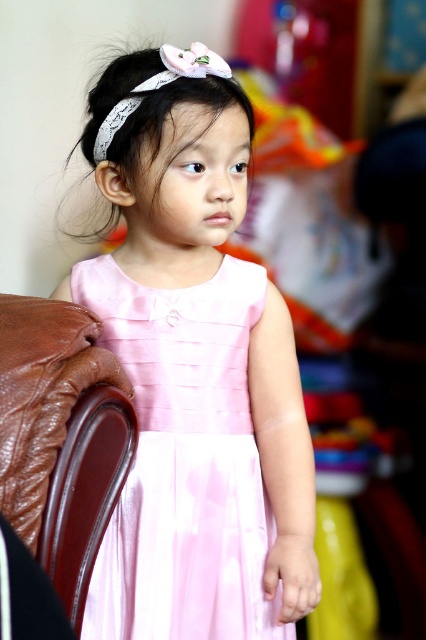
Question: Can you confirm if pink satin dress at center is bigger than brown leather armchair at left?

Choices:
 (A) no
 (B) yes

Answer: (B)

Question: Can you confirm if pink satin dress at center is positioned below white lace headband at upper center?

Choices:
 (A) yes
 (B) no

Answer: (A)

Question: Which point is closer to the camera taking this photo?

Choices:
 (A) (167, 64)
 (B) (215, 488)
 (C) (126, 93)

Answer: (A)

Question: Among these points, which one is nearest to the camera?

Choices:
 (A) (195, 448)
 (B) (98, 136)
 (C) (100, 77)

Answer: (A)

Question: Based on their relative distances, which object is farther from the pink satin dress at center?

Choices:
 (A) white lace headband at upper center
 (B) brown leather armchair at left
 (C) white satin headband at upper center

Answer: (C)

Question: From the image, what is the correct spatial relationship of pink satin dress at center in relation to white lace headband at upper center?

Choices:
 (A) right
 (B) left

Answer: (A)